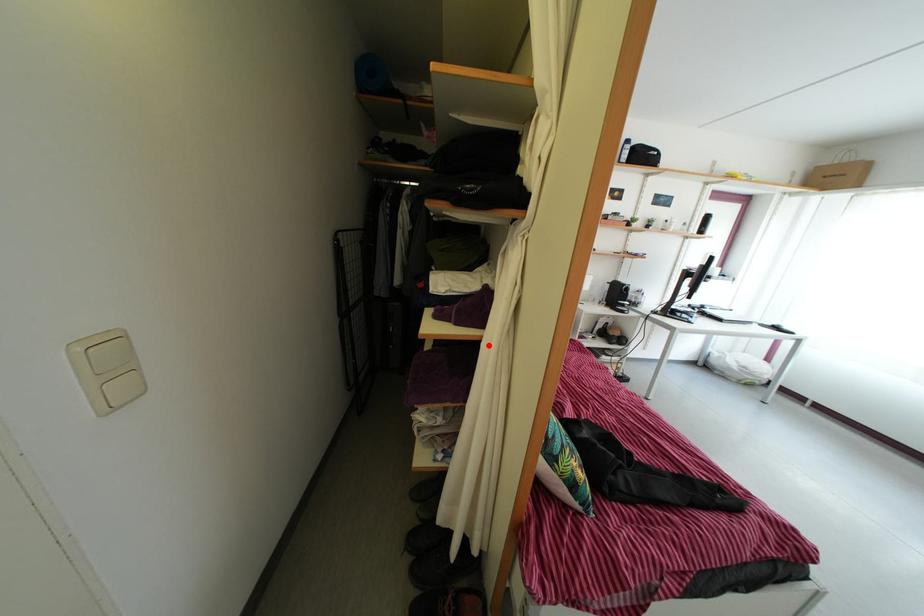
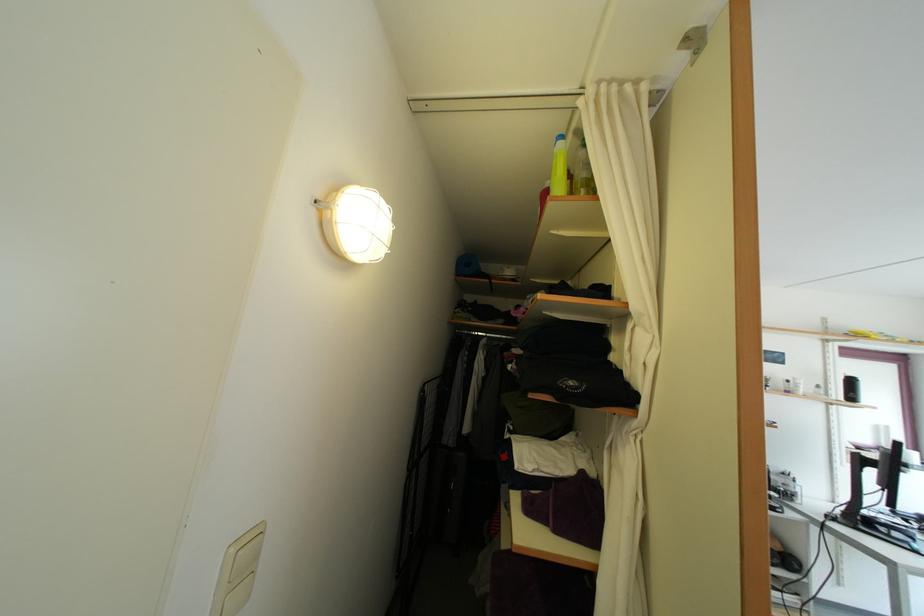
Question: I am providing you with two images of the same scene from different viewpoints. A red point is marked on the first image. Can you still see the location of the red point in image 2?

Choices:
 (A) Yes
 (B) No

Answer: (A)